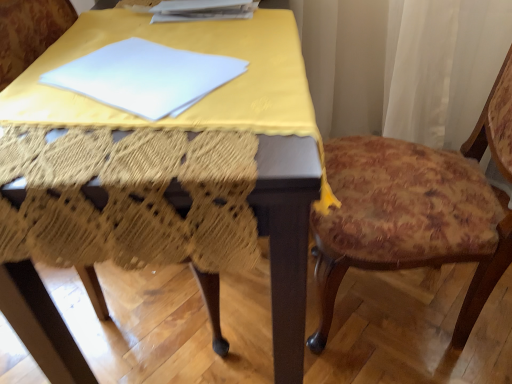
Question: Is white paper at upper center positioned with its back to floral fabric cushion at right?

Choices:
 (A) yes
 (B) no

Answer: (B)

Question: Is white paper at upper center positioned far away from floral fabric cushion at right?

Choices:
 (A) yes
 (B) no

Answer: (B)

Question: Is white paper at upper center wider than floral fabric cushion at right?

Choices:
 (A) no
 (B) yes

Answer: (A)

Question: Is floral fabric cushion at right completely or partially inside white paper at upper center?

Choices:
 (A) yes
 (B) no

Answer: (B)

Question: From a real-world perspective, does white paper at upper center stand above floral fabric cushion at right?

Choices:
 (A) no
 (B) yes

Answer: (B)

Question: Considering the relative sizes of white paper at upper center and floral fabric cushion at right in the image provided, is white paper at upper center bigger than floral fabric cushion at right?

Choices:
 (A) no
 (B) yes

Answer: (A)

Question: Is white paper at upper center facing towards yellow fabric-covered table at center?

Choices:
 (A) no
 (B) yes

Answer: (A)

Question: Is white paper at upper center positioned in front of yellow fabric-covered table at center?

Choices:
 (A) no
 (B) yes

Answer: (A)

Question: Is white paper at upper center touching yellow fabric-covered table at center?

Choices:
 (A) no
 (B) yes

Answer: (A)

Question: Can you confirm if white paper at upper center is wider than yellow fabric-covered table at center?

Choices:
 (A) no
 (B) yes

Answer: (A)

Question: Considering the relative sizes of white paper at upper center and yellow fabric-covered table at center in the image provided, is white paper at upper center smaller than yellow fabric-covered table at center?

Choices:
 (A) no
 (B) yes

Answer: (B)

Question: From a real-world perspective, is white paper at upper center located higher than yellow fabric-covered table at center?

Choices:
 (A) no
 (B) yes

Answer: (B)

Question: Does floral fabric cushion at right lie in front of white paper at upper center?

Choices:
 (A) no
 (B) yes

Answer: (B)